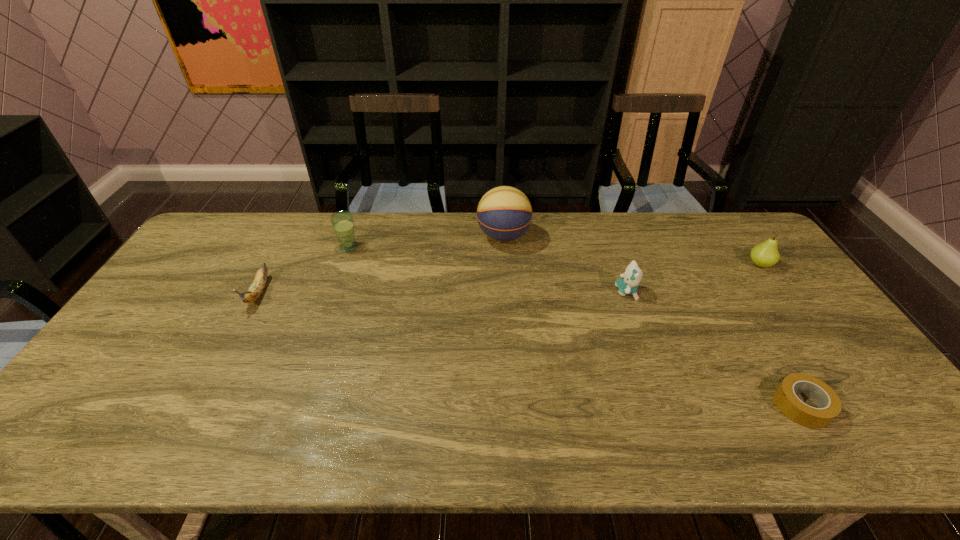
At what (x,y) coordinates should I click in order to perform the action: click on vacant space positioned on the patterned surface of the fourth object from right to left. Please return your answer as a coordinate pair (x, y). Looking at the image, I should click on click(x=376, y=237).

You are a GUI agent. You are given a task and a screenshot of the screen. Output one action in this format:
    pyautogui.click(x=<x>, y=<y>)
    Task: Click on the free space located 0.370m on the patterned surface of the fourth object from right to left
    Image resolution: width=960 pixels, height=540 pixels.
    Given the screenshot: What is the action you would take?
    pyautogui.click(x=371, y=237)

This screenshot has width=960, height=540. Find the location of `blank space located on the left of the glass`. blank space located on the left of the glass is located at coordinates (291, 247).

The height and width of the screenshot is (540, 960). Identify the location of vacant space located on the left of the rightmost object. (664, 265).

Identify the location of vacant area situated on the face of the kitten. The height and width of the screenshot is (540, 960). (557, 292).

The width and height of the screenshot is (960, 540). Identify the location of free space located on the face of the kitten. (573, 292).

The height and width of the screenshot is (540, 960). What are the coordinates of `free region located on the face of the kitten` in the screenshot? It's located at (550, 292).

At what (x,y) coordinates should I click in order to perform the action: click on free region located on the peel of the leftmost object. Please return your answer as a coordinate pair (x, y). Looking at the image, I should click on (206, 392).

This screenshot has height=540, width=960. Identify the location of free space located at the edge of the duct tape. (652, 406).

I want to click on vacant point located 0.080m at the edge of the duct tape, so click(x=739, y=406).